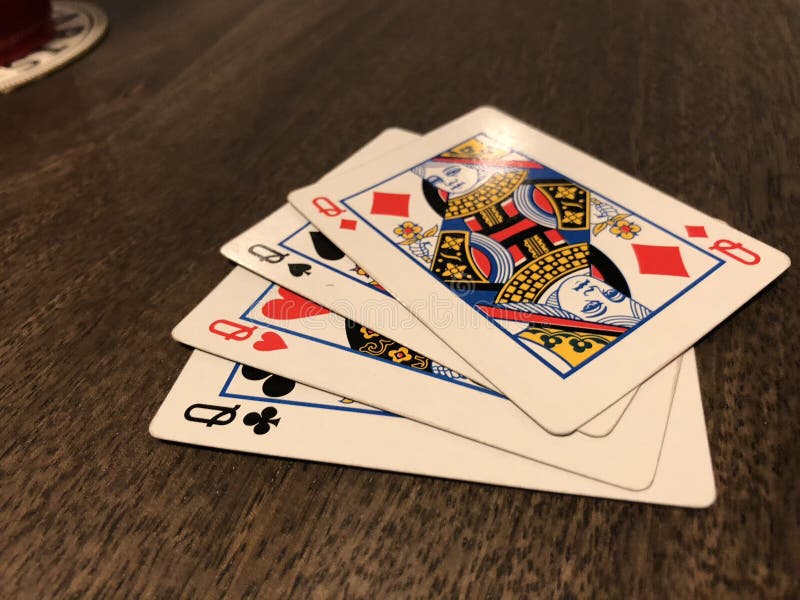
In order to click on playing cards in this screenshot , I will do `click(496, 290)`, `click(366, 287)`, `click(337, 360)`, `click(325, 421)`.